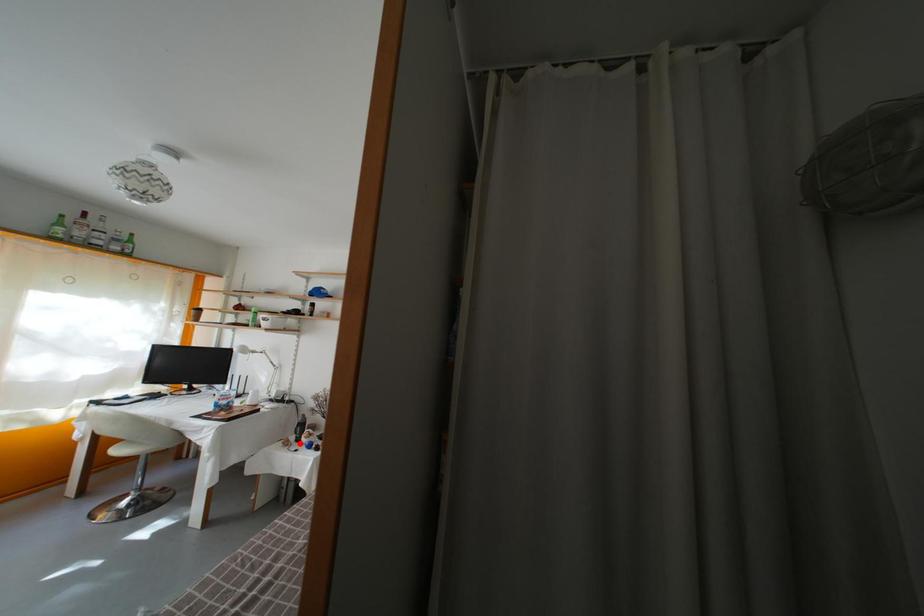
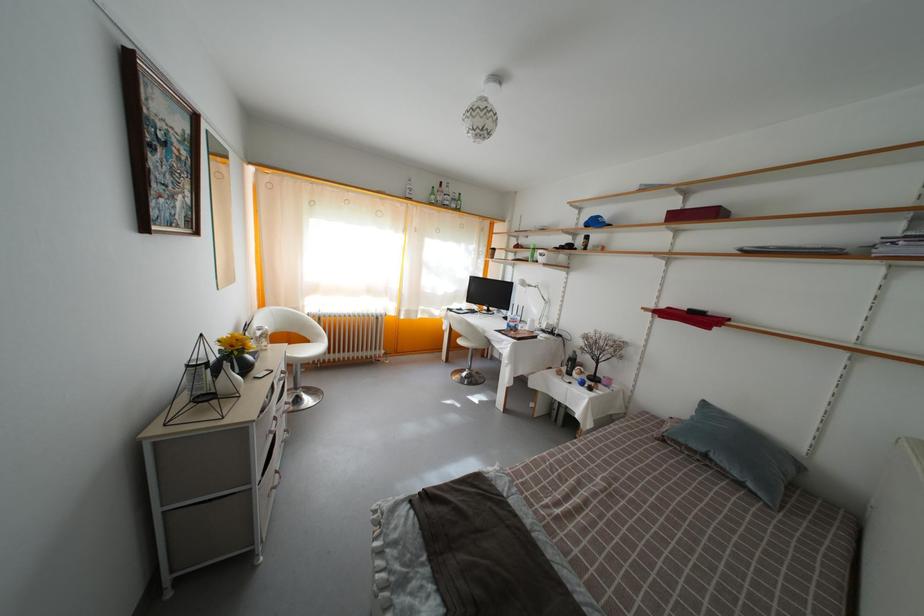
Question: I am providing you with two images of the same scene from different viewpoints. Given a red point in image1, look at the same physical point in image2. Is it:

Choices:
 (A) Closer to the viewpoint
 (B) Farther from the viewpoint

Answer: (A)